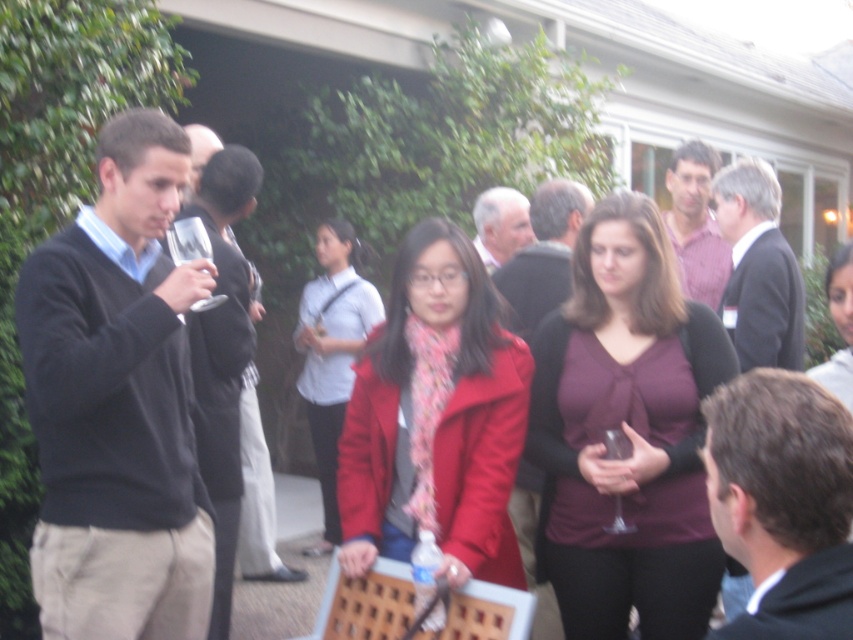
You are standing at the point marked as point [489,449] in the image, which is 9.07 feet away from you. You want to take a photo of the social gathering scene. Would you say that this point is close enough to capture the entire scene in the photo?

The point [489,449] is 9.07 feet away from you, so yes, this distance is close enough to capture the entire social gathering scene in the photo.

You are a photographer at this gathering, and you want to capture a photo that includes both the matte black sweater at left and the light gray hair at center. What is the minimum distance you need to move backward to ensure both subjects are fully in frame?

The minimum distance you need to move backward is 1.70 meters to ensure both the matte black sweater at left and the light gray hair at center are fully in frame.

You are a photographer at this event and want to capture both the matte black sweater at left and the light gray hair at center in a single photo. Which object should you focus on first to ensure both are in sharp focus?

You should focus on the matte black sweater at left first because it is closer to the viewer than the light gray hair at center, so focusing on the closer object will help both be in focus.